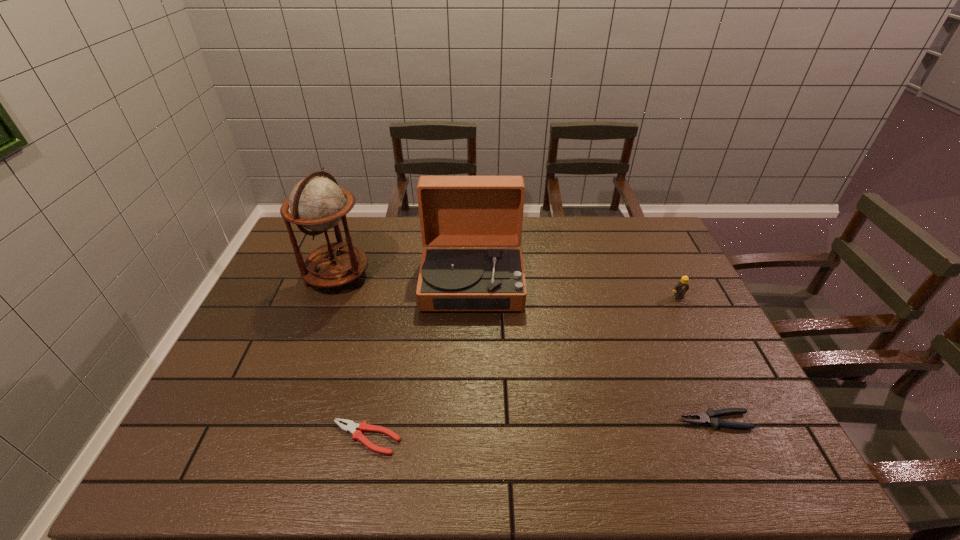
Locate an element on the screen. globe is located at coordinates (316, 203).

Locate an element on the screen. This screenshot has height=540, width=960. the tallest object is located at coordinates (316, 203).

Locate an element on the screen. This screenshot has height=540, width=960. the second tallest object is located at coordinates (455, 211).

You are a GUI agent. You are given a task and a screenshot of the screen. Output one action in this format:
    pyautogui.click(x=<x>, y=<y>)
    Task: Click on the Lego
    The image size is (960, 540).
    Given the screenshot: What is the action you would take?
    pyautogui.click(x=681, y=287)

Locate an element on the screen. The image size is (960, 540). the fourth tallest object is located at coordinates (709, 417).

Locate an element on the screen. the taller pliers is located at coordinates (709, 417).

The width and height of the screenshot is (960, 540). I want to click on the shorter pliers, so click(351, 427).

Image resolution: width=960 pixels, height=540 pixels. I want to click on the left pliers, so click(351, 427).

Locate an element on the screen. The image size is (960, 540). free space located 0.050m on the surface of the leftmost object is located at coordinates (385, 276).

In order to click on vacant space located on the face of the phonograph record in this screenshot , I will do `click(470, 360)`.